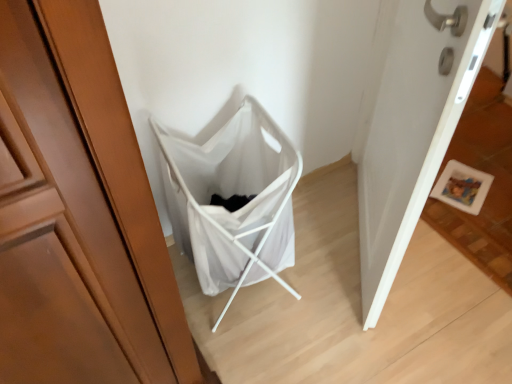
Question: Can you confirm if white fabric laundry basket at center is thinner than white matte door at lower right?

Choices:
 (A) no
 (B) yes

Answer: (A)

Question: Does white fabric laundry basket at center have a greater width compared to white matte door at lower right?

Choices:
 (A) yes
 (B) no

Answer: (A)

Question: Is white fabric laundry basket at center facing away from white matte door at lower right?

Choices:
 (A) no
 (B) yes

Answer: (A)

Question: From a real-world perspective, is white fabric laundry basket at center positioned under white matte door at lower right based on gravity?

Choices:
 (A) yes
 (B) no

Answer: (A)

Question: Is white fabric laundry basket at center behind white matte door at lower right?

Choices:
 (A) yes
 (B) no

Answer: (A)

Question: Is white fabric laundry basket at center shorter than white matte door at lower right?

Choices:
 (A) no
 (B) yes

Answer: (B)

Question: Does white matte door at lower right come in front of white fabric laundry basket at center?

Choices:
 (A) no
 (B) yes

Answer: (B)

Question: Would you say white matte door at lower right is a long distance from white fabric laundry basket at center?

Choices:
 (A) no
 (B) yes

Answer: (A)

Question: Can you confirm if white matte door at lower right is taller than white fabric laundry basket at center?

Choices:
 (A) yes
 (B) no

Answer: (A)

Question: Considering the relative sizes of white matte door at lower right and white fabric laundry basket at center in the image provided, is white matte door at lower right bigger than white fabric laundry basket at center?

Choices:
 (A) no
 (B) yes

Answer: (B)

Question: From a real-world perspective, is white matte door at lower right positioned under white fabric laundry basket at center based on gravity?

Choices:
 (A) no
 (B) yes

Answer: (A)

Question: Is white matte door at lower right directly adjacent to white fabric laundry basket at center?

Choices:
 (A) yes
 (B) no

Answer: (B)

Question: Is white fabric laundry basket at center inside the boundaries of white matte door at lower right, or outside?

Choices:
 (A) inside
 (B) outside

Answer: (B)